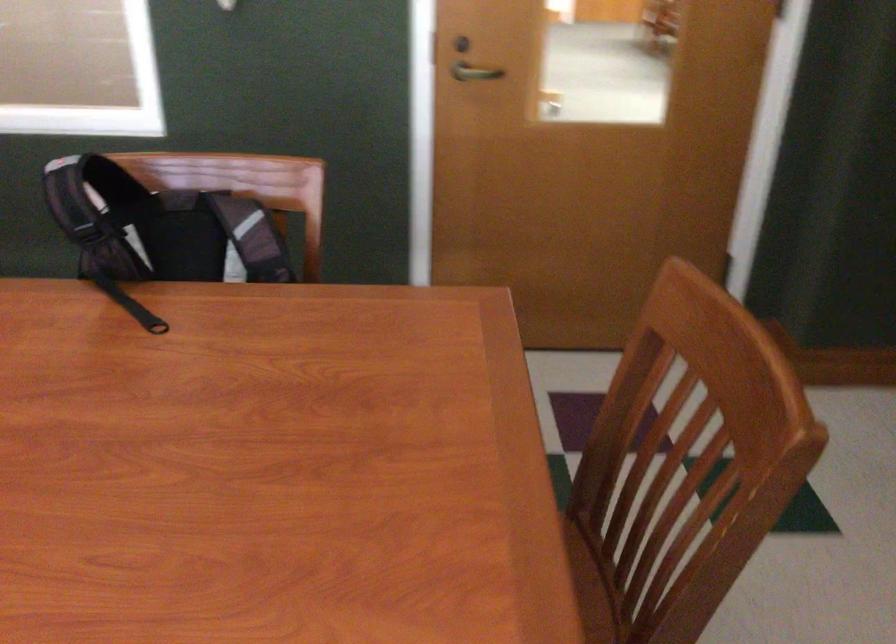
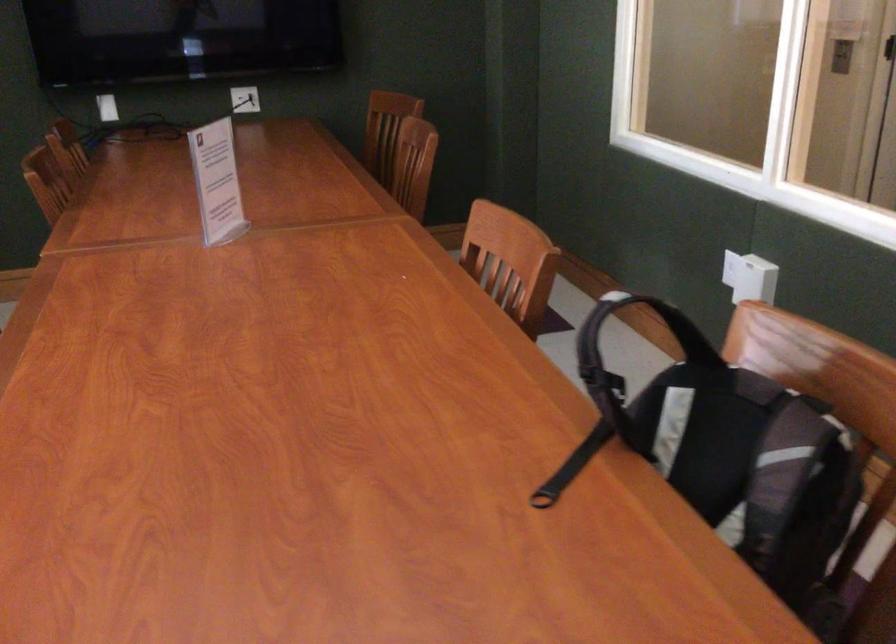
Locate, in the second image, the point that corresponds to (134,308) in the first image.

(572, 466)